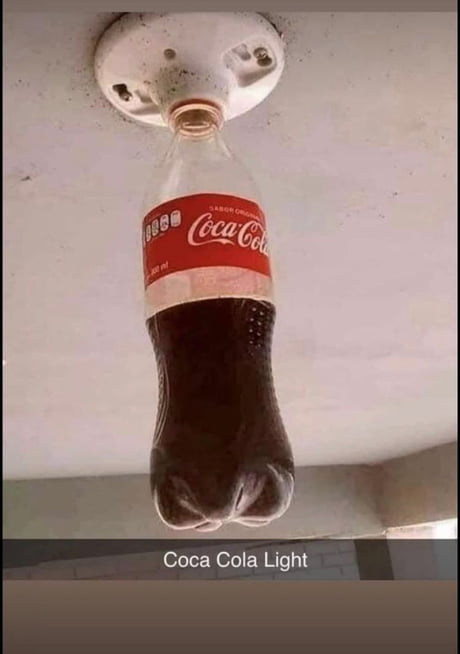
Where is `ceiling`? The height and width of the screenshot is (654, 460). ceiling is located at coordinates (93, 394).